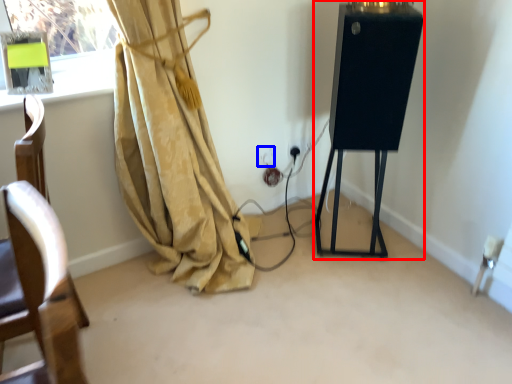
Question: Which object is closer to the camera taking this photo, easel (highlighted by a red box) or electric outlet (highlighted by a blue box)?

Choices:
 (A) easel
 (B) electric outlet

Answer: (A)